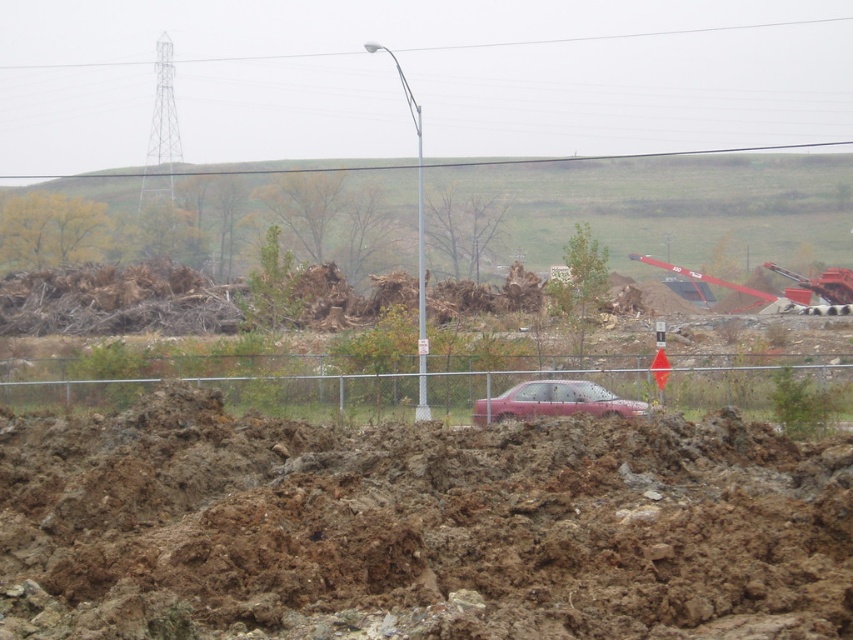
You are standing at the origin point in the construction site. There are two points marked on the ground, point 1 at coordinates point (436,401) and point 2 at coordinates point (498,404). If you want to walk towards point 1, which point will you pass through first?

Point 2 at coordinates point (498,404) is in front of point 1 at coordinates point (436,401), so you will pass through point 2 first before reaching point 1.

You are a surveyor standing at the origin point of the construction site. You need to determine the shortest path to reach the brown muddy dirt at center without crossing any fences or obstacles. Can you confirm if the dirt is directly in front of you or requires a detour?

The brown muddy dirt at center is located at point (418, 528), which suggests it is positioned to the right and slightly forward from your starting position. Therefore, you may need to adjust your path slightly to the right to reach it without crossing obstacles.